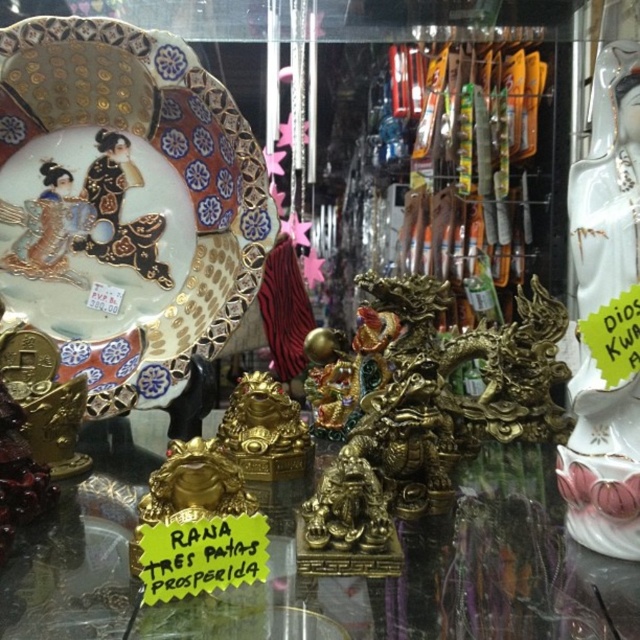
Question: Which point appears closest to the camera in this image?

Choices:
 (A) (618, 531)
 (B) (0, 573)
 (C) (193, 205)

Answer: (B)

Question: Among these objects, which one is nearest to the camera?

Choices:
 (A) porcelain statue at right
 (B) porcelain painted plate at upper left

Answer: (A)

Question: Is gold metallic statue at center further to the viewer compared to porcelain statue at right?

Choices:
 (A) no
 (B) yes

Answer: (A)

Question: Does porcelain painted plate at upper left appear on the left side of porcelain statue at right?

Choices:
 (A) no
 (B) yes

Answer: (B)

Question: Does gold metallic statue at center have a smaller size compared to porcelain statue at right?

Choices:
 (A) yes
 (B) no

Answer: (B)

Question: Which object is the farthest from the porcelain painted plate at upper left?

Choices:
 (A) gold metallic statue at center
 (B) porcelain statue at right

Answer: (B)